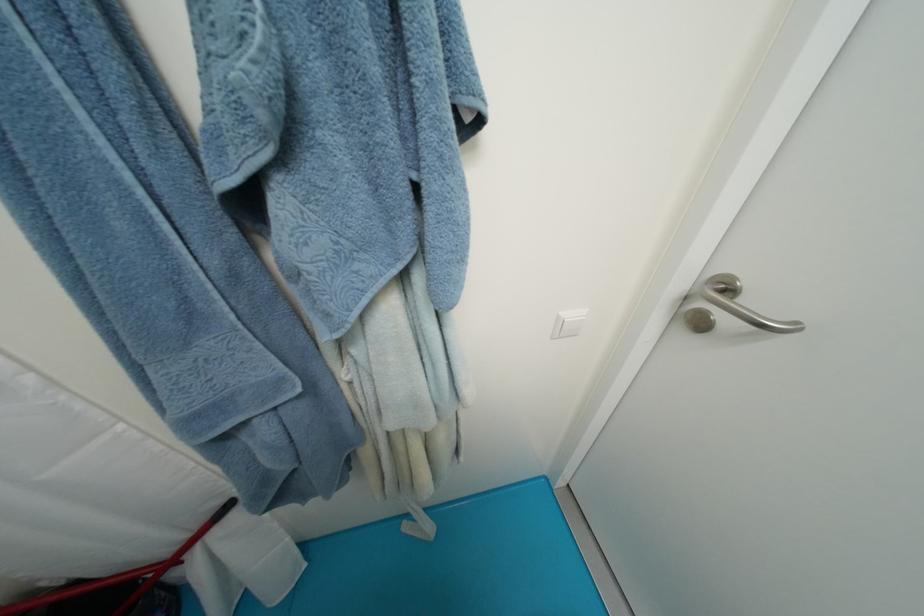
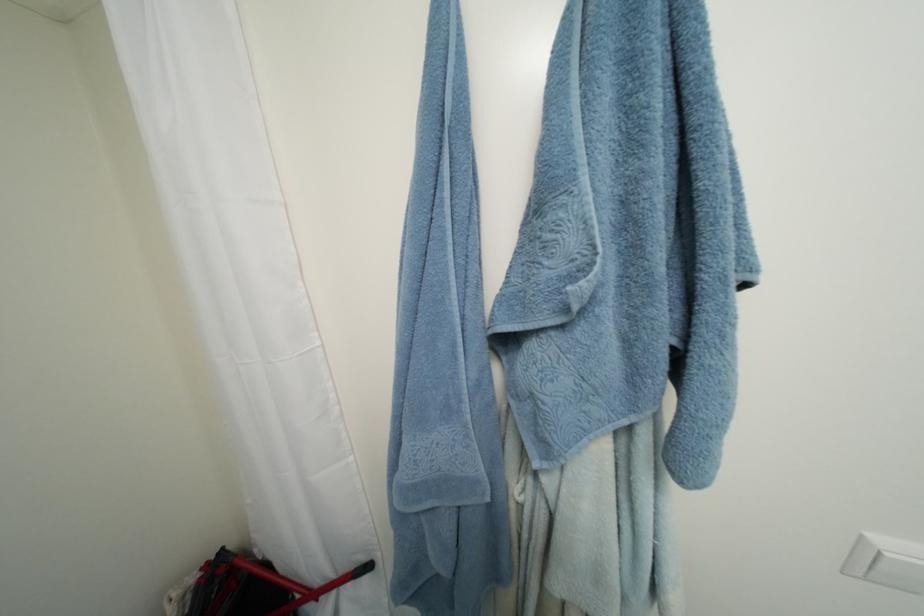
The images are taken continuously from a first-person perspective. In which direction is your viewpoint rotating?

The camera's rotation is toward left-up.